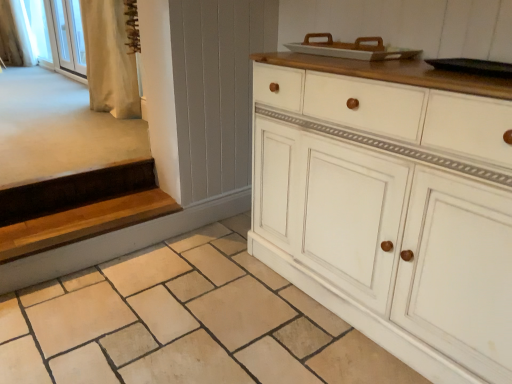
Question: Does white fabric at upper left have a smaller size compared to white painted wood cabinet at center?

Choices:
 (A) yes
 (B) no

Answer: (A)

Question: Does white fabric at upper left touch white painted wood cabinet at center?

Choices:
 (A) yes
 (B) no

Answer: (B)

Question: Is white fabric at upper left outside white painted wood cabinet at center?

Choices:
 (A) yes
 (B) no

Answer: (A)

Question: Does white fabric at upper left have a larger size compared to white painted wood cabinet at center?

Choices:
 (A) no
 (B) yes

Answer: (A)

Question: Can you confirm if white fabric at upper left is shorter than white painted wood cabinet at center?

Choices:
 (A) yes
 (B) no

Answer: (A)

Question: Is white fabric at upper left further to camera compared to white painted wood cabinet at center?

Choices:
 (A) no
 (B) yes

Answer: (B)

Question: Considering the relative sizes of natural stone tile at lower center and white fabric at upper left in the image provided, is natural stone tile at lower center bigger than white fabric at upper left?

Choices:
 (A) no
 (B) yes

Answer: (A)

Question: Considering the relative positions of natural stone tile at lower center and white fabric at upper left in the image provided, is natural stone tile at lower center in front of white fabric at upper left?

Choices:
 (A) yes
 (B) no

Answer: (A)

Question: From the image's perspective, would you say natural stone tile at lower center is positioned over white fabric at upper left?

Choices:
 (A) yes
 (B) no

Answer: (B)

Question: Does natural stone tile at lower center have a smaller size compared to white fabric at upper left?

Choices:
 (A) no
 (B) yes

Answer: (B)

Question: Is natural stone tile at lower center facing towards white fabric at upper left?

Choices:
 (A) no
 (B) yes

Answer: (A)

Question: Can you confirm if natural stone tile at lower center is positioned to the right of white fabric at upper left?

Choices:
 (A) no
 (B) yes

Answer: (B)

Question: Is white glass screen door at upper left next to white fabric curtain at upper left, which ranks as the second curtain in right-to-left order, and touching it?

Choices:
 (A) no
 (B) yes

Answer: (A)